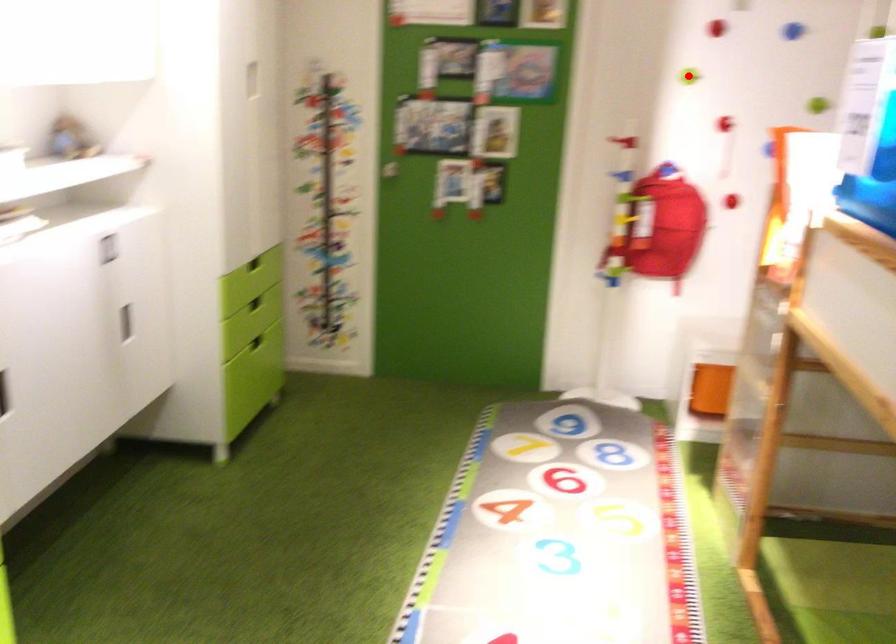
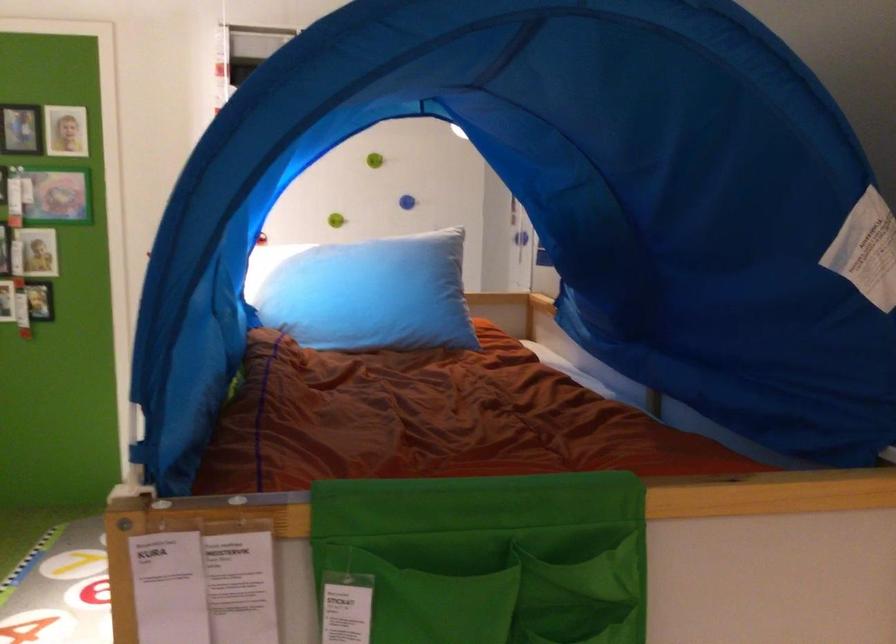
Question: I am providing you with two images of the same scene from different viewpoints. A red point is marked on the first image. Is the red point's position out of view in image 2?

Choices:
 (A) Yes
 (B) No

Answer: (A)